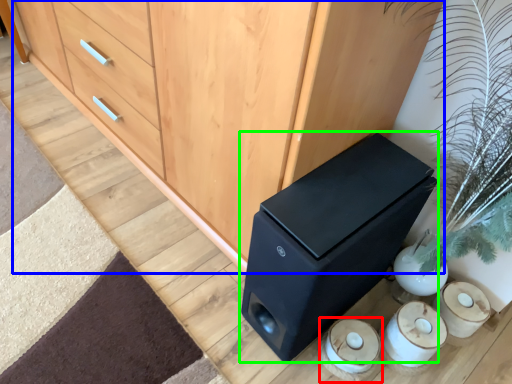
Question: Which is nearer to the candle holder (highlighted by a red box)? chest of drawers (highlighted by a blue box) or furniture (highlighted by a green box).

Choices:
 (A) chest of drawers
 (B) furniture

Answer: (B)